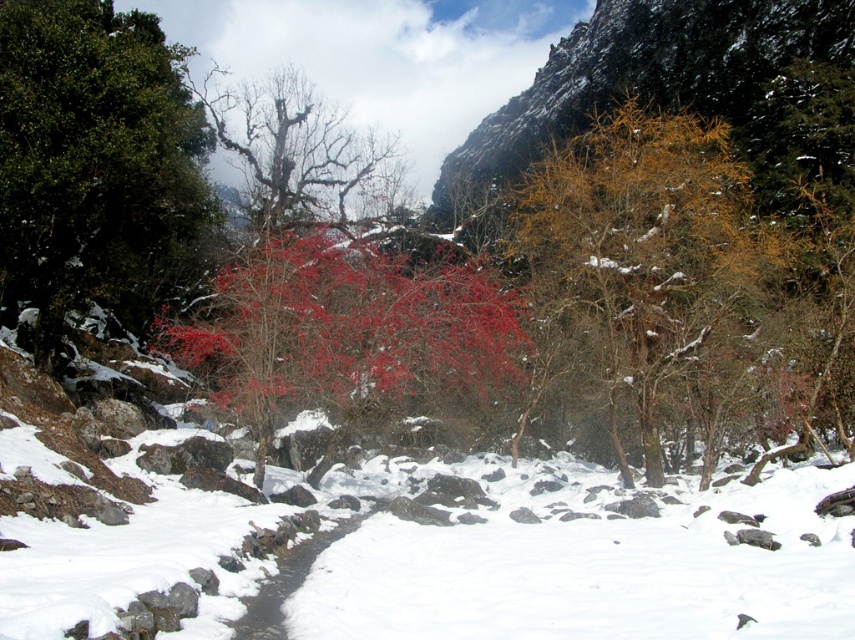
You are an artist trying to paint the winter scene. You notice the white fluffy snow at center and the bright red leaves at center. Based on their positions, which one should you paint first to ensure proper layering?

The bright red leaves at center should be painted first because the white fluffy snow at center is on the right side of them, meaning the snow is layered over the red leaves on that side. Painting the red leaves first allows the snow to be added on top in the correct position.